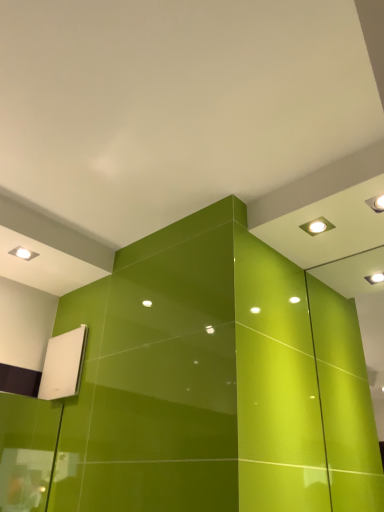
This screenshot has width=384, height=512. What do you see at coordinates (63, 365) in the screenshot? I see `white glossy lift at lower left` at bounding box center [63, 365].

The image size is (384, 512). What are the coordinates of `white glossy lift at lower left` in the screenshot? It's located at (63, 365).

Measure the distance between white glossy lift at lower left and camera.

The depth of white glossy lift at lower left is 1.49 meters.

Find the location of a particular element. This screenshot has width=384, height=512. white glossy lift at lower left is located at coordinates (63, 365).